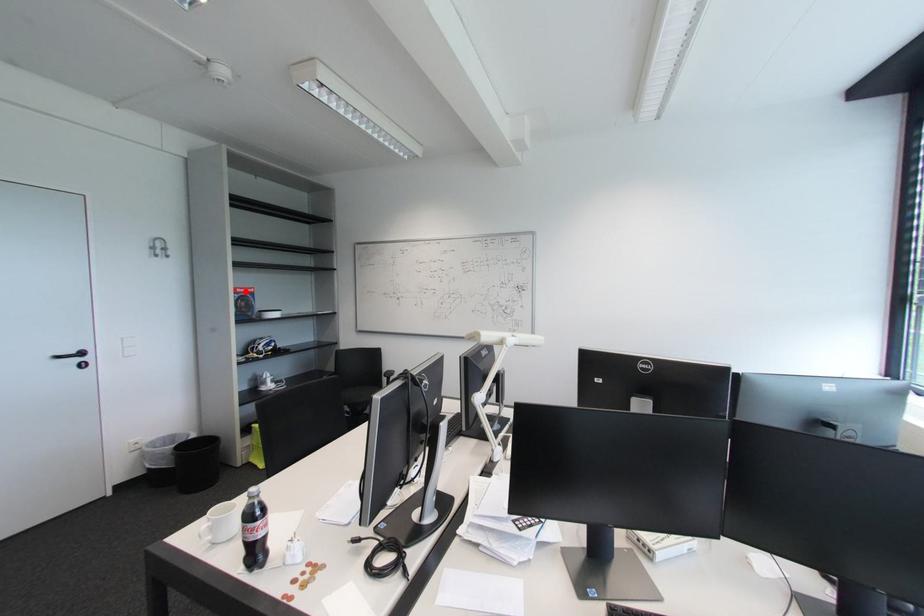
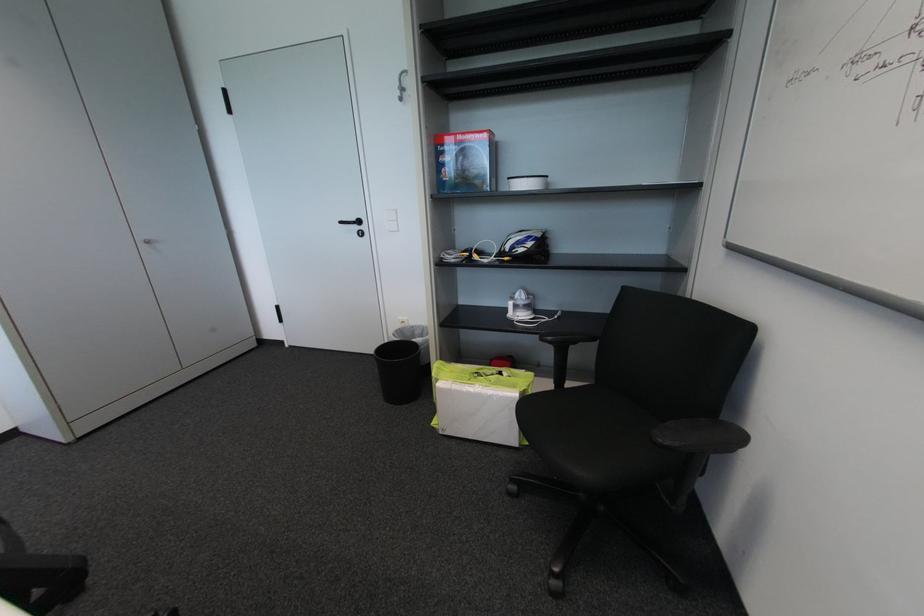
Question: I am providing you with two images of the same scene from different viewpoints. A red point is marked on the first image. Is the red point's position out of view in image 2?

Choices:
 (A) Yes
 (B) No

Answer: (B)